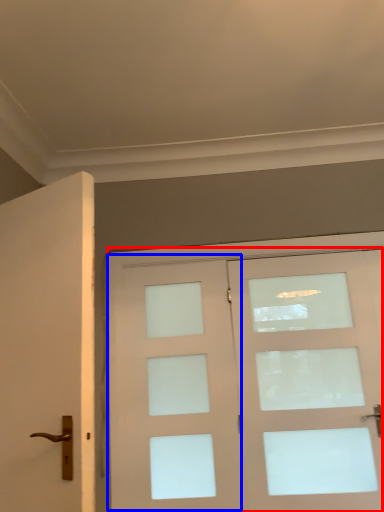
Question: Which object appears closest to the camera in this image, door (highlighted by a red box) or screen door (highlighted by a blue box)?

Choices:
 (A) door
 (B) screen door

Answer: (A)